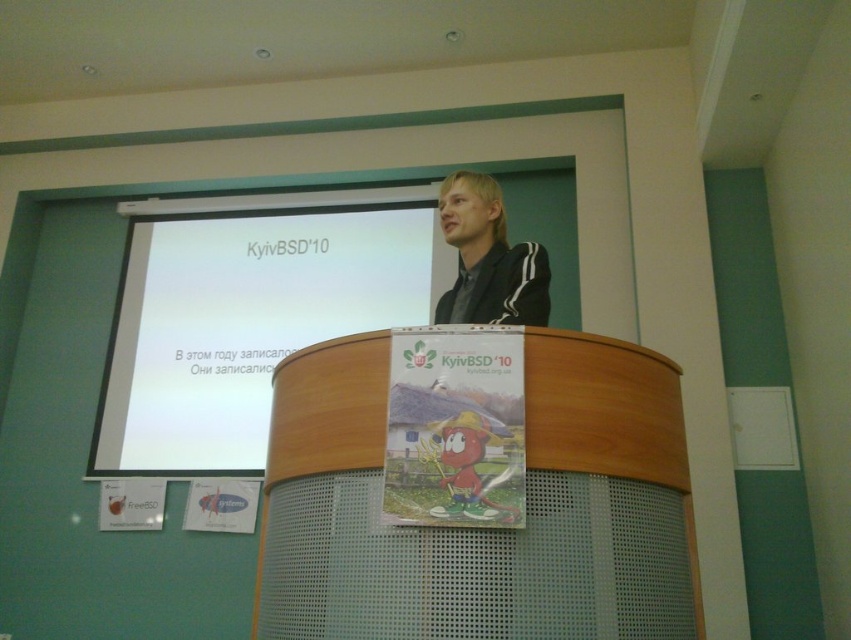
Question: Which point is farther to the camera?

Choices:
 (A) white matte projection screen at upper center
 (B) wooden podium at center
 (C) black matte jacket at upper center

Answer: (A)

Question: Among these points, which one is farthest from the camera?

Choices:
 (A) (466, 182)
 (B) (557, 520)

Answer: (A)

Question: Does white matte projection screen at upper center have a smaller size compared to black matte jacket at upper center?

Choices:
 (A) yes
 (B) no

Answer: (B)

Question: Does wooden podium at center come behind white matte projection screen at upper center?

Choices:
 (A) no
 (B) yes

Answer: (A)

Question: Is wooden podium at center behind black matte jacket at upper center?

Choices:
 (A) no
 (B) yes

Answer: (A)

Question: Among these points, which one is farthest from the camera?

Choices:
 (A) (473, 292)
 (B) (357, 308)

Answer: (B)